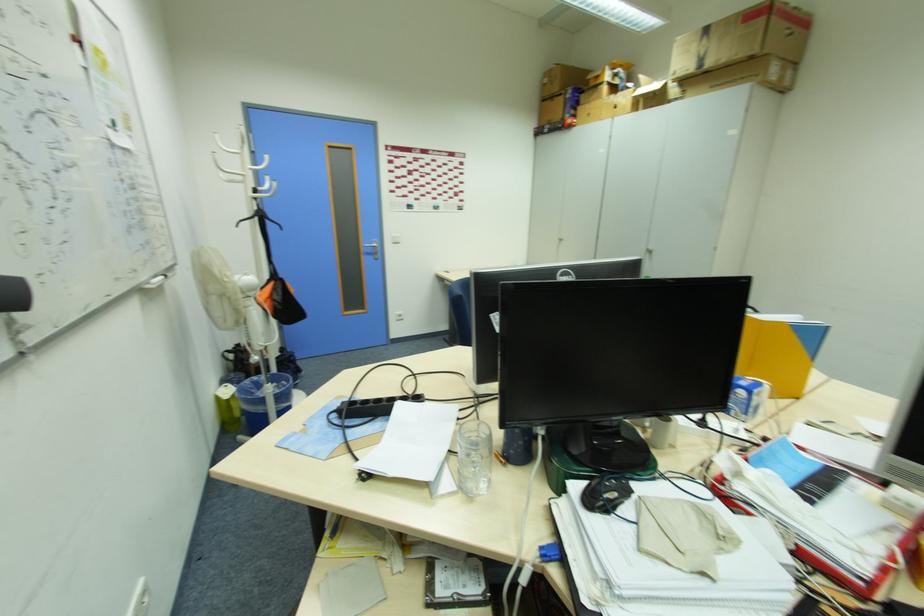
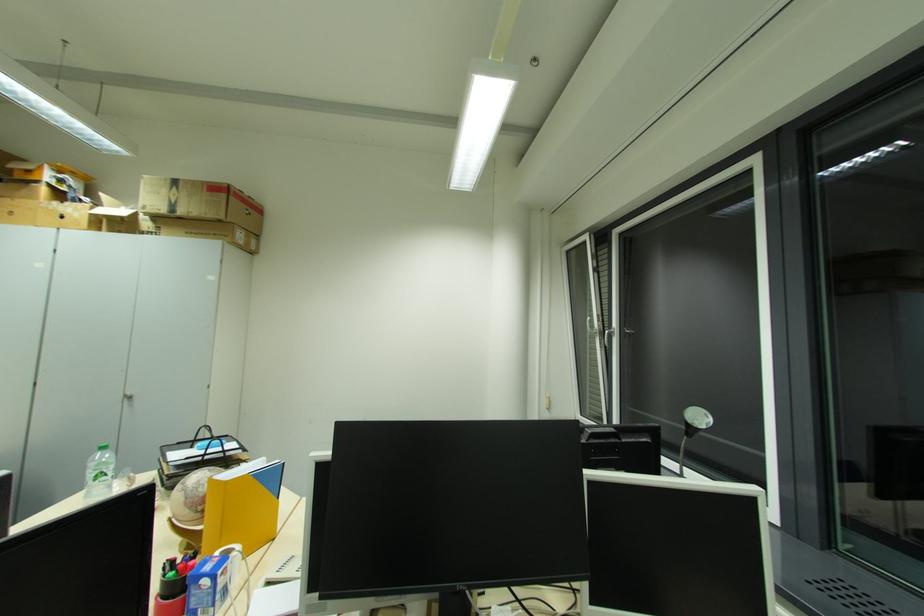
The point at (650, 254) is marked in the first image. Where is the corresponding point in the second image?

(128, 400)